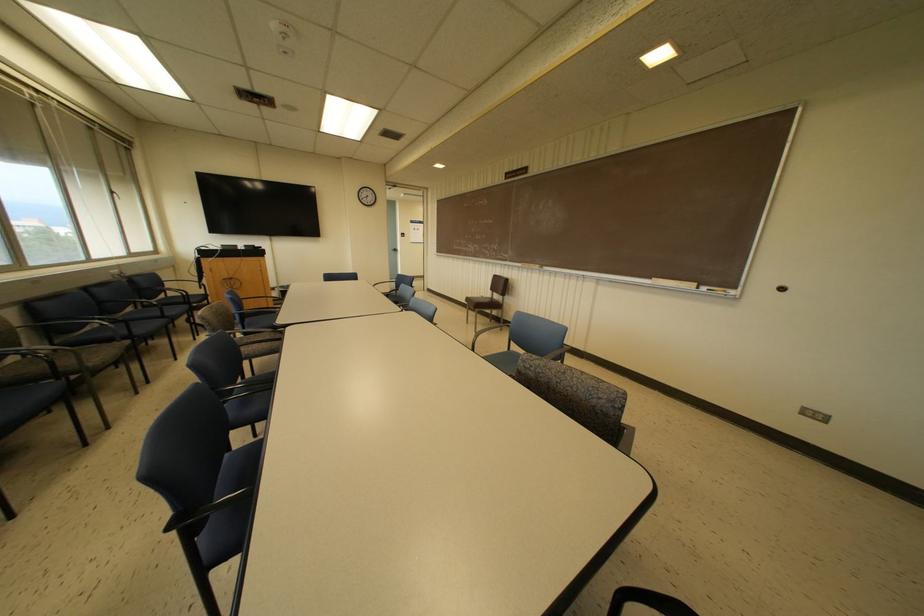
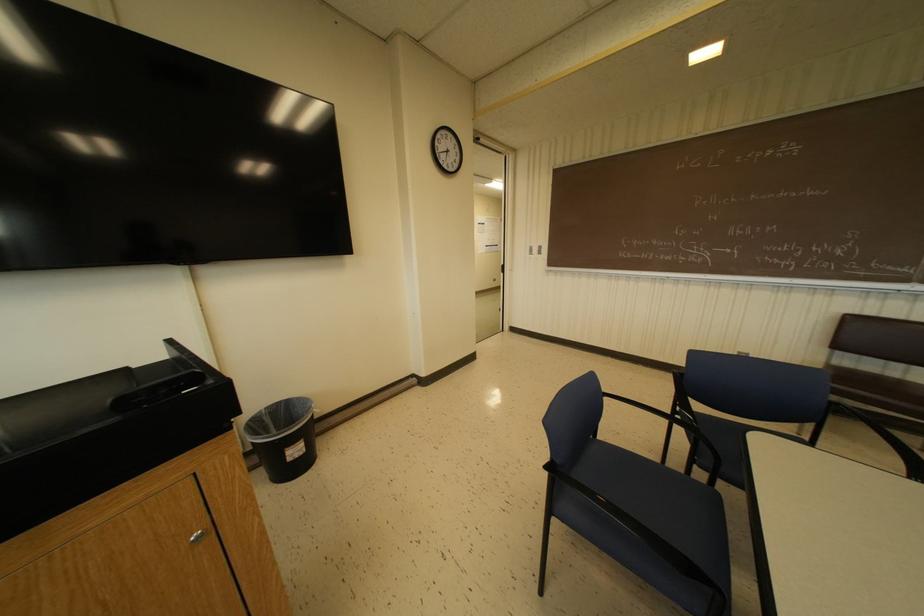
What movement of the cameraman would produce the second image?

The cameraman moved toward left, forward.